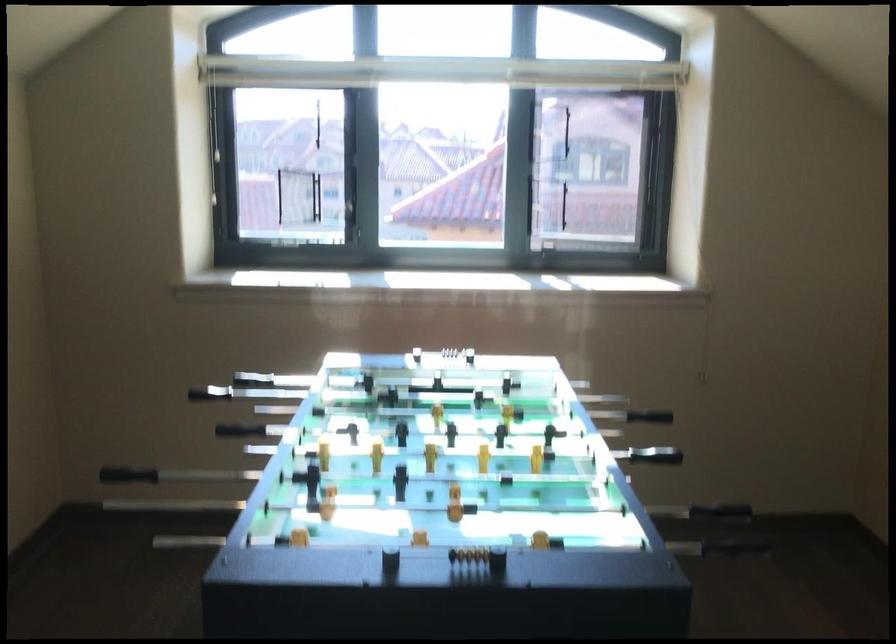
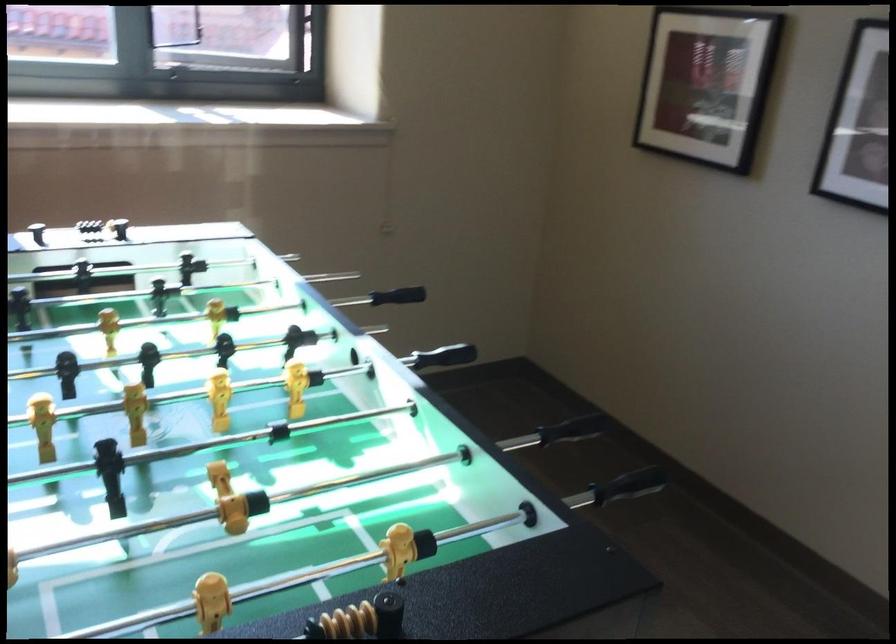
Question: The images are taken continuously from a first-person perspective. In which direction is your viewpoint rotating?

Choices:
 (A) Left
 (B) Right
 (C) Up
 (D) Down

Answer: (B)